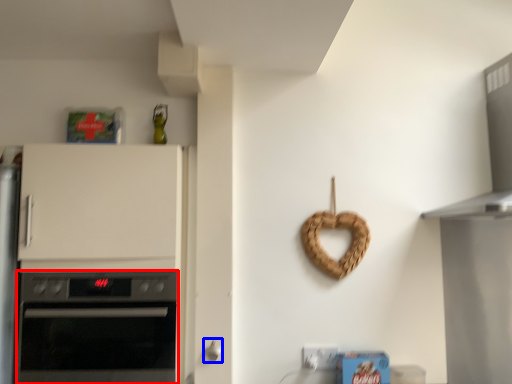
Question: Which object appears farthest to the camera in this image, oven (highlighted by a red box) or door handle (highlighted by a blue box)?

Choices:
 (A) oven
 (B) door handle

Answer: (B)